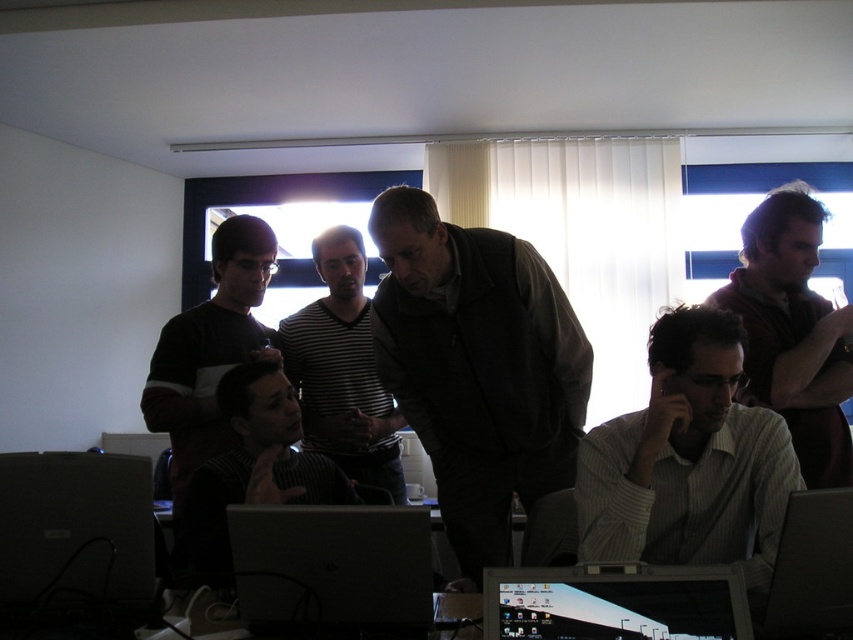
Which is more to the right, dark gray vest at center or black knitwear at center?

Positioned to the right is dark gray vest at center.

Can you confirm if dark gray vest at center is positioned above black knitwear at center?

Yes, dark gray vest at center is above black knitwear at center.

Who is more forward, [485,352] or [257,445]?

Positioned in front is point [485,352].

Locate an element on the screen. The image size is (853, 640). dark gray vest at center is located at coordinates (477, 365).

Locate an element on the screen. This screenshot has height=640, width=853. silver metallic laptop at center is located at coordinates (332, 566).

Can you confirm if silver metallic laptop at center is positioned above black knitwear at center?

Incorrect, silver metallic laptop at center is not positioned above black knitwear at center.

Is point (236, 545) positioned in front of point (283, 388)?

That is True.

Locate an element on the screen. The width and height of the screenshot is (853, 640). silver metallic laptop at center is located at coordinates (332, 566).

Based on the photo, does dark gray vest at center have a greater height compared to striped shirt at center?

Indeed, dark gray vest at center has a greater height compared to striped shirt at center.

Measure the distance between point (469,260) and camera.

Point (469,260) and camera are 6.58 feet apart.

What do you see at coordinates (477, 365) in the screenshot?
I see `dark gray vest at center` at bounding box center [477, 365].

Image resolution: width=853 pixels, height=640 pixels. I want to click on dark gray vest at center, so click(x=477, y=365).